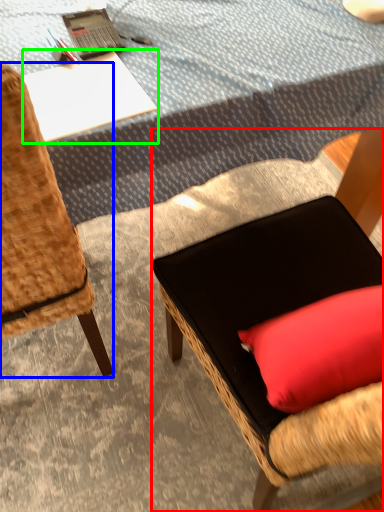
Question: Considering the real-world distances, which object is farthest from chair (highlighted by a red box)? chair (highlighted by a blue box) or desk (highlighted by a green box)?

Choices:
 (A) chair
 (B) desk

Answer: (B)